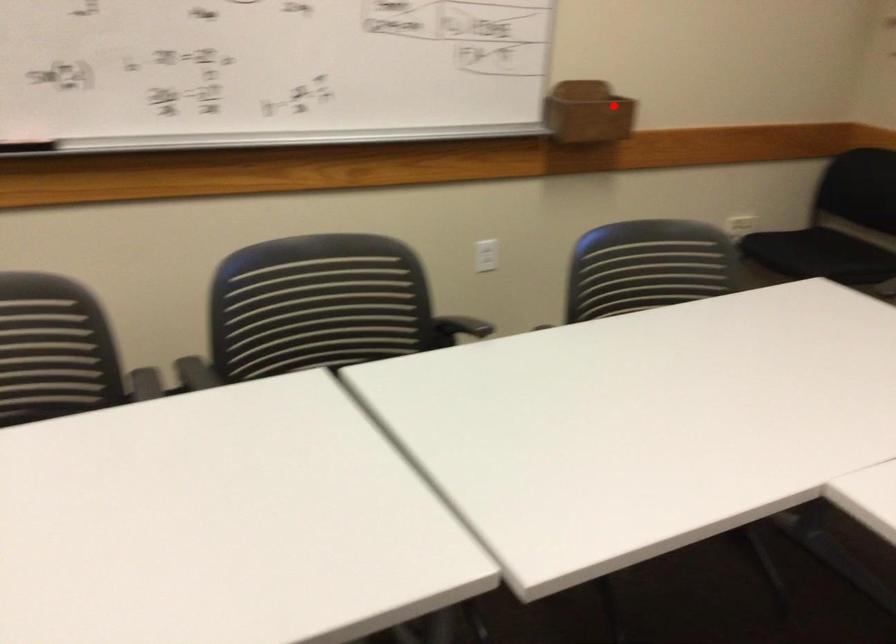
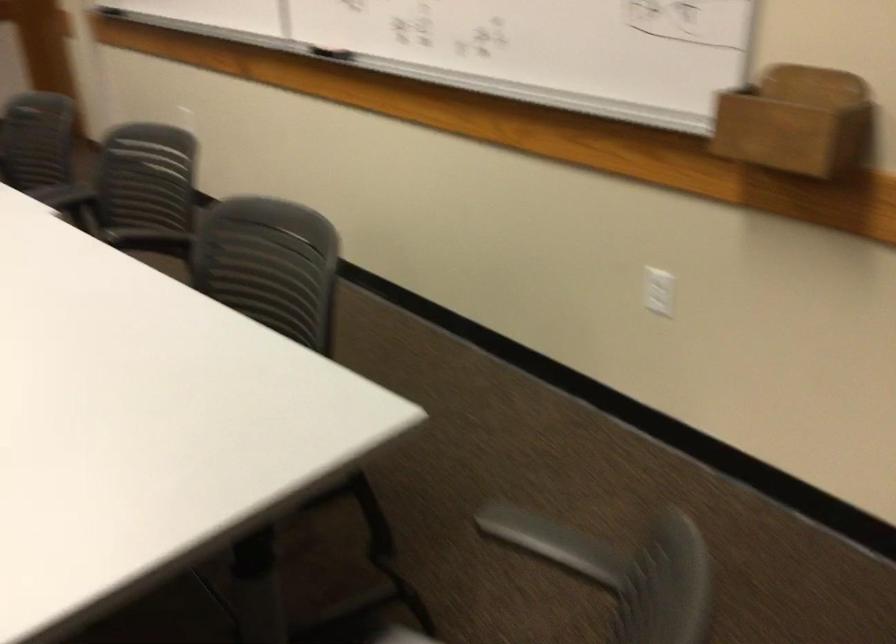
Find the pixel in the second image that matches the highlighted location in the first image.

(797, 122)